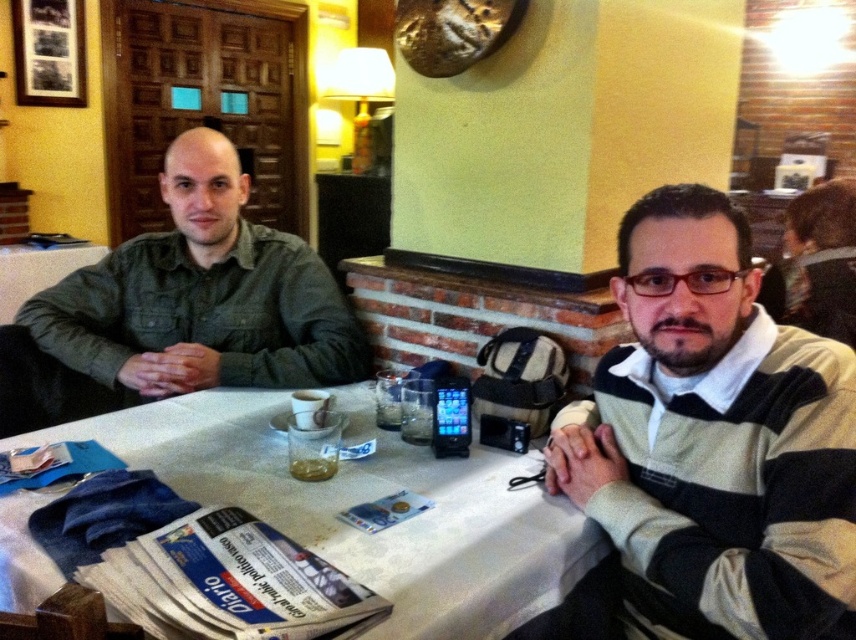
Locate an element on the screen. Image resolution: width=856 pixels, height=640 pixels. striped sweater at center is located at coordinates click(x=706, y=448).

At what (x,y) coordinates should I click in order to perform the action: click on striped sweater at center. Please return your answer as a coordinate pair (x, y). Looking at the image, I should click on (706, 448).

Who is positioned more to the left, striped sweater at center or green denim shirt at left?

green denim shirt at left

Between striped sweater at center and green denim shirt at left, which one has more height?

green denim shirt at left

You are a GUI agent. You are given a task and a screenshot of the screen. Output one action in this format:
    pyautogui.click(x=<x>, y=<y>)
    Task: Click on the striped sweater at center
    The height and width of the screenshot is (640, 856).
    Given the screenshot: What is the action you would take?
    pyautogui.click(x=706, y=448)

Based on the photo, can you confirm if white textured table at center is thinner than green denim shirt at left?

Incorrect, white textured table at center's width is not less than green denim shirt at left's.

Can you confirm if white textured table at center is shorter than green denim shirt at left?

Indeed, white textured table at center has a lesser height compared to green denim shirt at left.

What do you see at coordinates (366, 500) in the screenshot? I see `white textured table at center` at bounding box center [366, 500].

The height and width of the screenshot is (640, 856). Identify the location of white textured table at center. (366, 500).